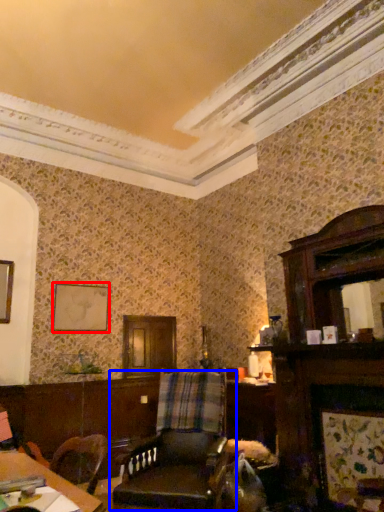
Question: Which object is closer to the camera taking this photo, picture frame (highlighted by a red box) or chair (highlighted by a blue box)?

Choices:
 (A) picture frame
 (B) chair

Answer: (B)